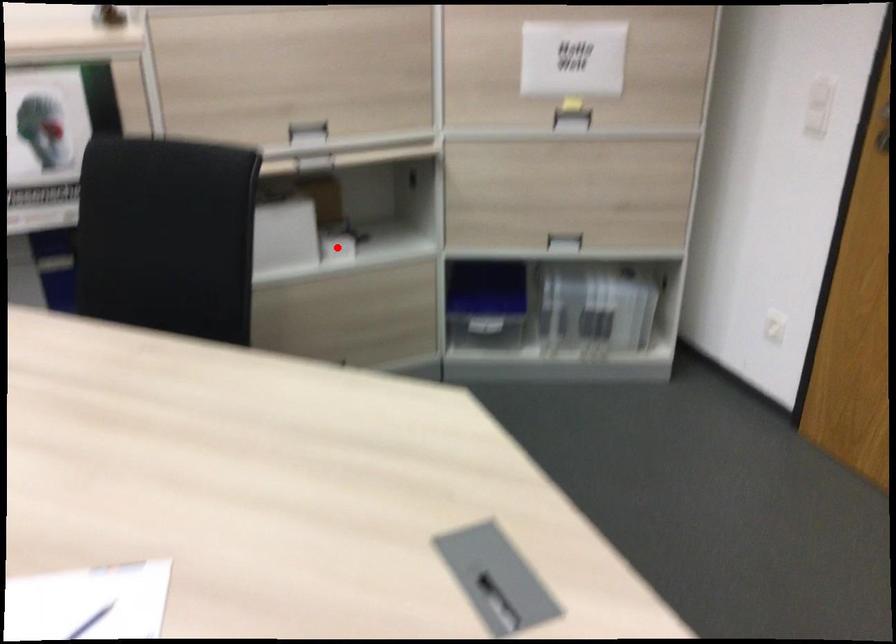
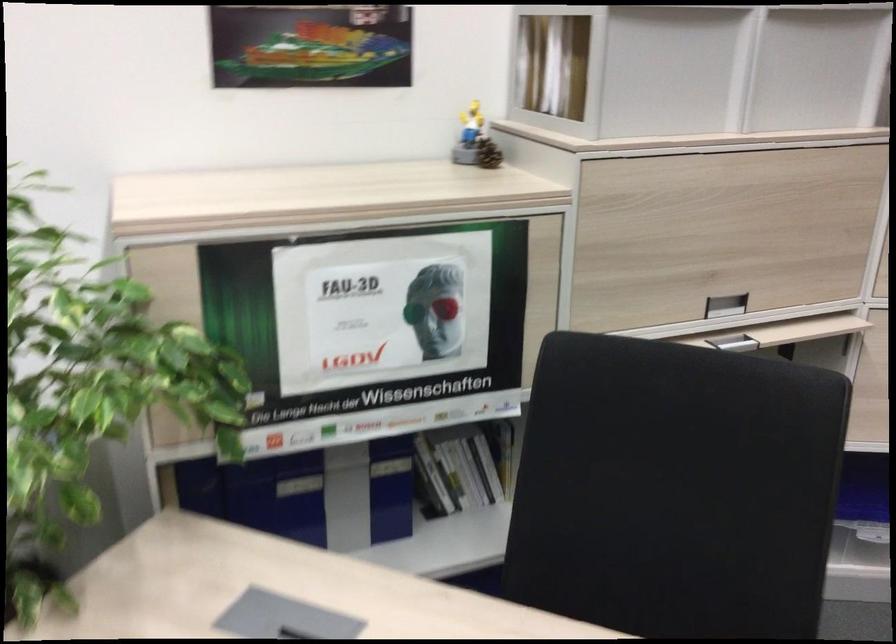
Question: I am providing you with two images of the same scene from different viewpoints. A red point is marked on the first image. Can you still see the location of the red point in image 2?

Choices:
 (A) Yes
 (B) No

Answer: (B)